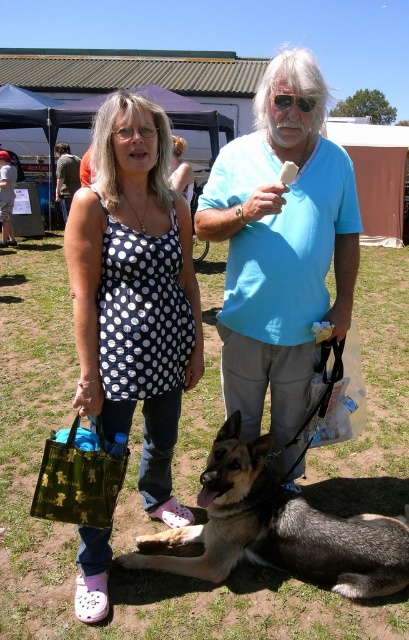
Measure the distance from polka dot fabric dress at center to brown fur dog at center.

polka dot fabric dress at center and brown fur dog at center are 19.10 inches apart from each other.

Is polka dot fabric dress at center to the right of brown fur dog at center from the viewer's perspective?

In fact, polka dot fabric dress at center is to the left of brown fur dog at center.

Is point (224, 173) less distant than point (307, 524)?

No.

You are a GUI agent. You are given a task and a screenshot of the screen. Output one action in this format:
    pyautogui.click(x=<x>, y=<y>)
    Task: Click on the polka dot fabric dress at center
    
    Given the screenshot: What is the action you would take?
    pyautogui.click(x=280, y=244)

Is blue cotton shirt at center above brown fur dog at center?

Yes, blue cotton shirt at center is above brown fur dog at center.

Who is more distant from viewer, (267, 173) or (242, 465)?

Point (242, 465)

This screenshot has height=640, width=409. In order to click on blue cotton shirt at center in this screenshot , I will do `click(280, 244)`.

Looking at this image, which of these two, polka dot fabric dress at center or blue cotton shirt at center, stands shorter?

blue cotton shirt at center is shorter.

Consider the image. Can you confirm if polka dot fabric dress at center is thinner than blue cotton shirt at center?

In fact, polka dot fabric dress at center might be wider than blue cotton shirt at center.

Is point (256, 355) positioned behind point (285, 292)?

Yes, it is.

What are the coordinates of `polka dot fabric dress at center` in the screenshot? It's located at (280, 244).